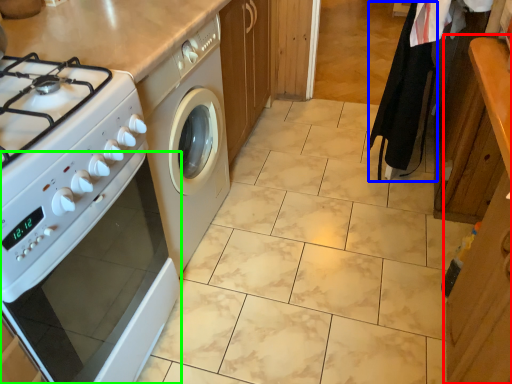
Question: Based on their relative distances, which object is nearer to cabinetry (highlighted by a red box)? Choose from robe (highlighted by a blue box) and oven (highlighted by a green box).

Choices:
 (A) robe
 (B) oven

Answer: (A)